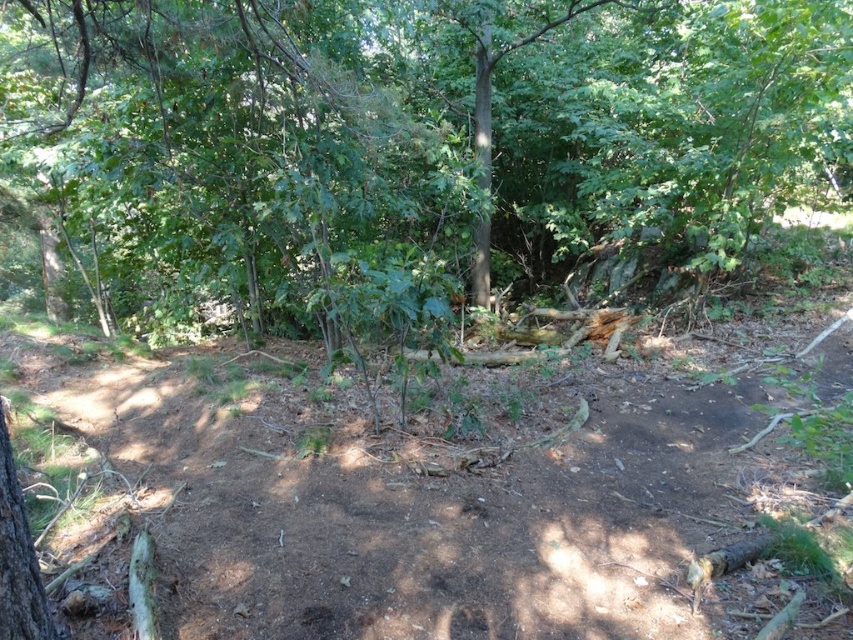
Question: Does green leafy tree at center have a lesser width compared to brown dirt track at center?

Choices:
 (A) yes
 (B) no

Answer: (A)

Question: Which point appears closest to the camera in this image?

Choices:
 (A) (289, 33)
 (B) (224, 620)

Answer: (B)

Question: Does green leafy tree at center appear over brown dirt track at center?

Choices:
 (A) yes
 (B) no

Answer: (A)

Question: Can you confirm if green leafy tree at center is smaller than brown dirt track at center?

Choices:
 (A) yes
 (B) no

Answer: (A)